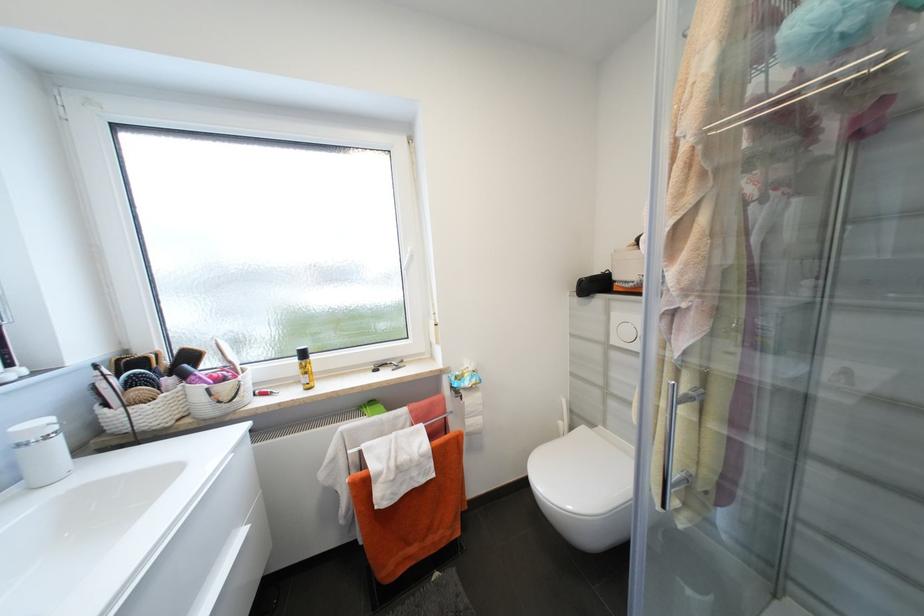
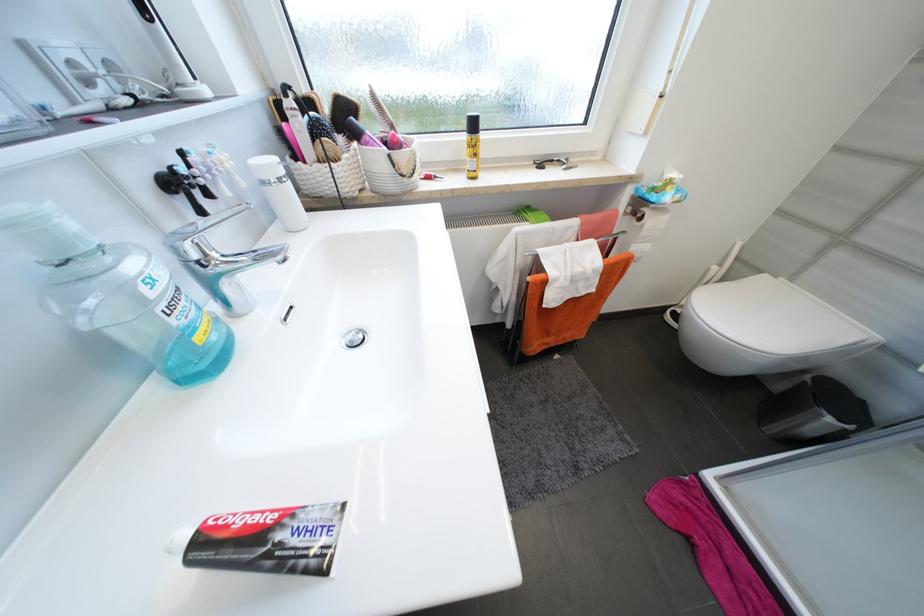
Question: I am providing you with two images of the same scene from different viewpoints. After the viewpoint changes to image2, which objects are now occluded?

Choices:
 (A) metal razor
 (B) pink spray can
 (C) white toilet lid
 (D) none of these

Answer: (D)